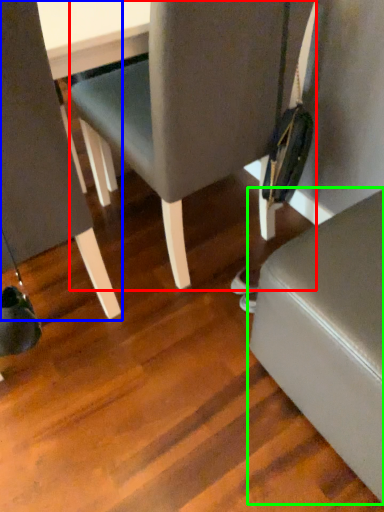
Question: Which is nearer to the chair (highlighted by a red box)? chair (highlighted by a blue box) or furniture (highlighted by a green box).

Choices:
 (A) chair
 (B) furniture

Answer: (A)